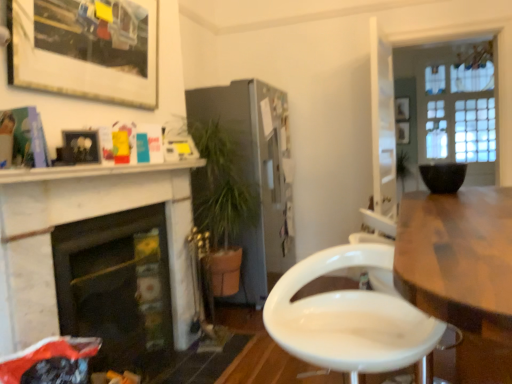
Question: Considering the positions of white marble fireplace at left, which ranks as the 1th fireplace in front-to-back order, and matte white picture frame at upper left, the first picture frame when ordered from front to back, in the image, is white marble fireplace at left, which ranks as the 1th fireplace in front-to-back order, wider or thinner than matte white picture frame at upper left, the first picture frame when ordered from front to back,?

Choices:
 (A) wide
 (B) thin

Answer: (A)

Question: In terms of height, does white marble fireplace at left, which is the second fireplace from back to front, look taller or shorter compared to matte white picture frame at upper left, the first picture frame positioned from the left?

Choices:
 (A) short
 (B) tall

Answer: (B)

Question: Estimate the real-world distances between objects in this image. Which object is closer to the wooden picture frame at upper right, which ranks as the 2th picture frame in right-to-left order?

Choices:
 (A) black glass fireplace at left, the 1th fireplace viewed from the back
 (B) white marble shelf at upper left
 (C) wooden table at right
 (D) black matte bowl at upper right
 (E) satin silver refrigerator at center

Answer: (E)

Question: Considering the real-world distances, which object is farthest from the white marble shelf at upper left?

Choices:
 (A) white marble fireplace at left, which is the second fireplace from back to front
 (B) matte white picture frame at upper left, the first picture frame when ordered from front to back
 (C) wooden table at right
 (D) matte black picture frame at upper left, acting as the 3th picture frame starting from the back
 (E) black glass fireplace at left, acting as the second fireplace starting from the front

Answer: (C)